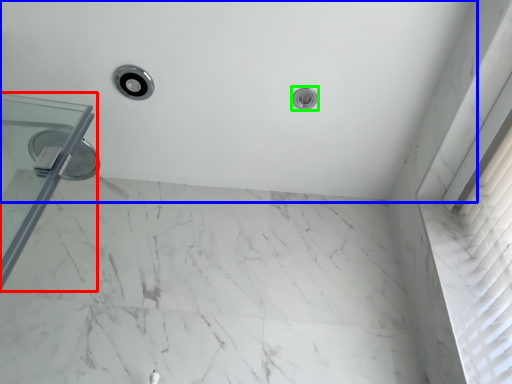
Question: Which is nearer to the glass door (highlighted by a red box)? bath (highlighted by a blue box) or shower (highlighted by a green box).

Choices:
 (A) bath
 (B) shower

Answer: (A)